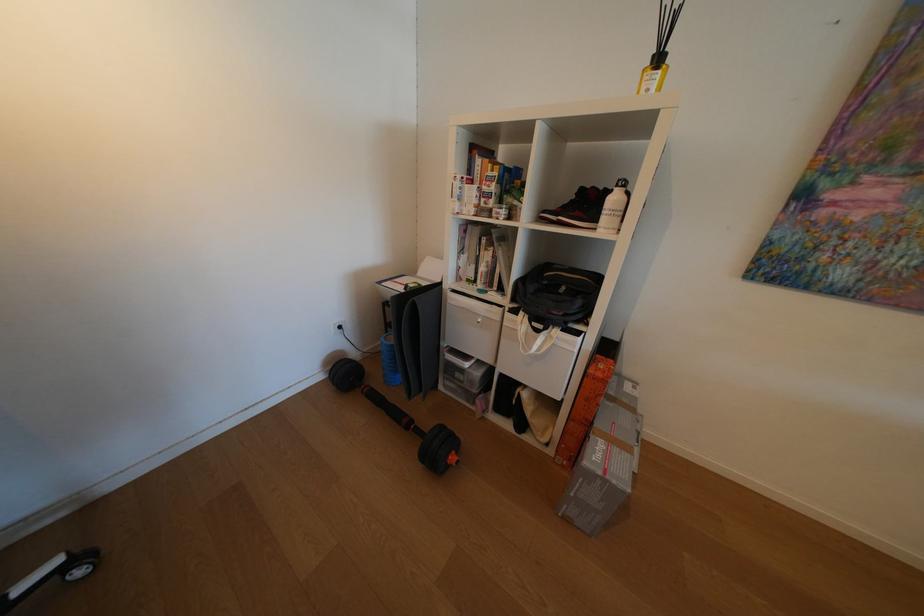
Where is `orange cardboard box`? orange cardboard box is located at coordinates 585,406.